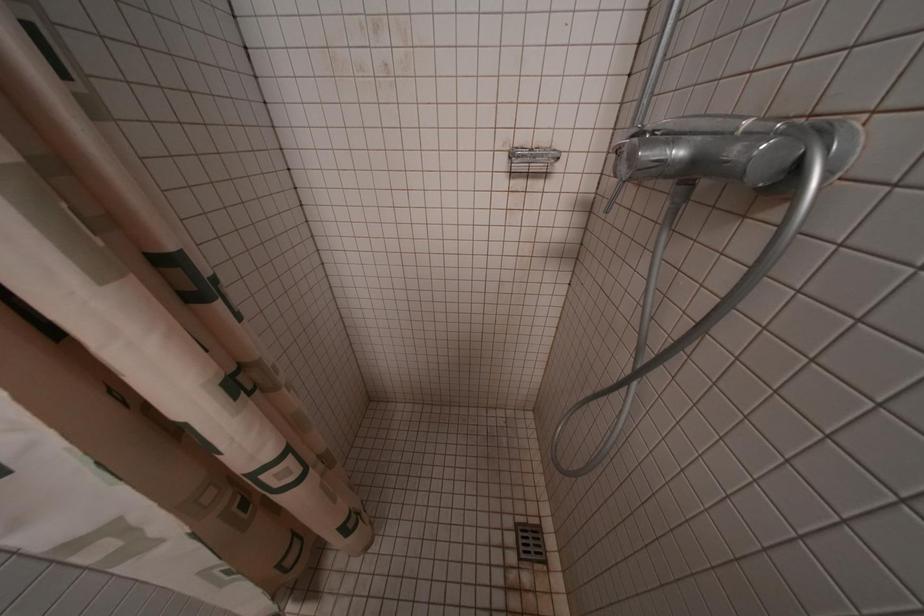
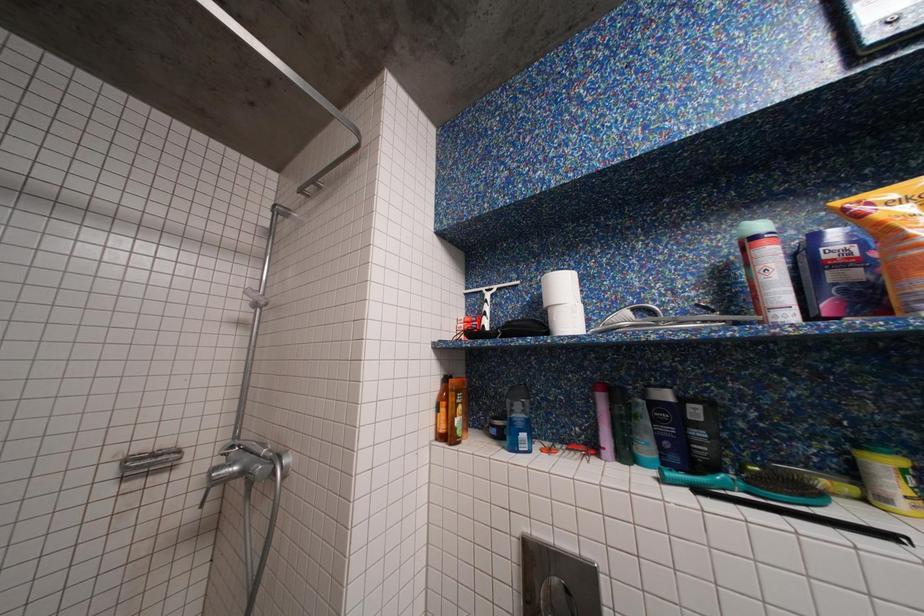
How did the camera likely rotate?

The camera's rotation is toward right-up.